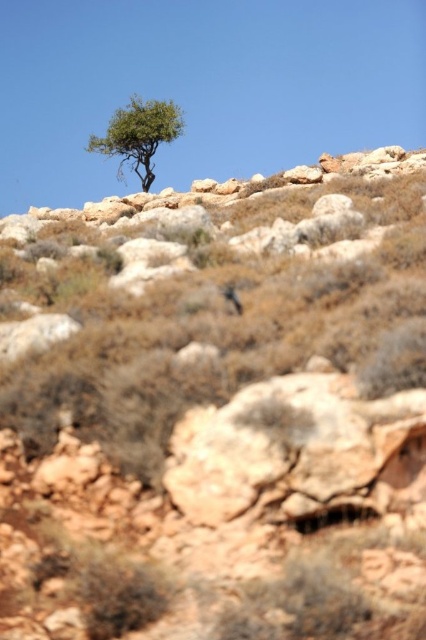
Question: Which point appears farthest from the camera in this image?

Choices:
 (A) (132, 131)
 (B) (247, 440)

Answer: (A)

Question: Does rusty rock at center come in front of green leafy tree at upper center?

Choices:
 (A) yes
 (B) no

Answer: (A)

Question: Which object is farther from the camera taking this photo?

Choices:
 (A) rusty rock at center
 (B) green leafy tree at upper center

Answer: (B)

Question: Does rusty rock at center appear under green leafy tree at upper center?

Choices:
 (A) yes
 (B) no

Answer: (A)

Question: Where is rusty rock at center located in relation to green leafy tree at upper center in the image?

Choices:
 (A) above
 (B) below

Answer: (B)